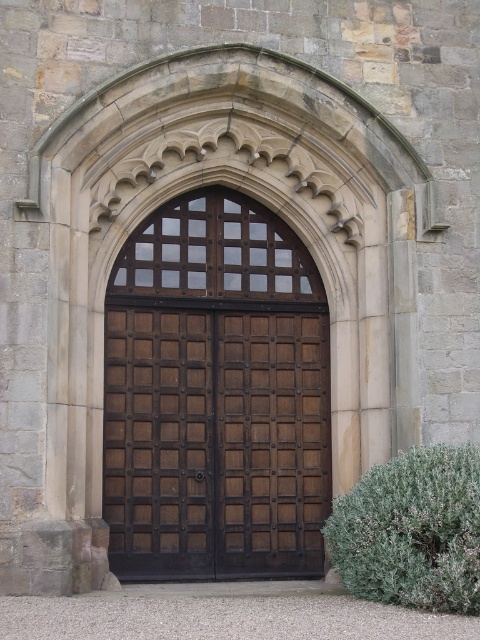
Question: Which point appears farthest from the camera in this image?

Choices:
 (A) (269, 272)
 (B) (464, 547)

Answer: (A)

Question: Where is brown wooden door at center located in relation to green leafy bush at lower right in the image?

Choices:
 (A) below
 (B) above

Answer: (B)

Question: Which object appears farthest from the camera in this image?

Choices:
 (A) brown wooden door at center
 (B) green leafy bush at lower right

Answer: (A)

Question: Can you confirm if brown wooden door at center is bigger than green leafy bush at lower right?

Choices:
 (A) yes
 (B) no

Answer: (A)

Question: Is brown wooden door at center thinner than green leafy bush at lower right?

Choices:
 (A) no
 (B) yes

Answer: (A)